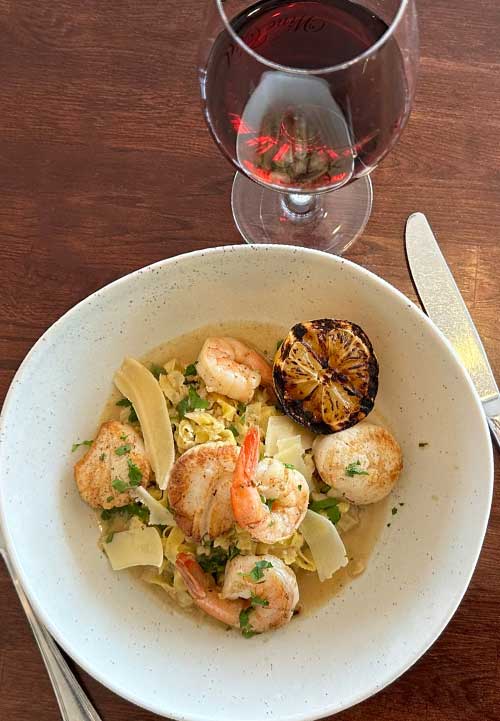
At what (x,y) coordinates should I click in order to perform the action: click on dark brown wood table. Please return your answer as a coordinate pair (x, y). The height and width of the screenshot is (721, 500). Looking at the image, I should click on (99, 199), (451, 686), (109, 703), (23, 694).